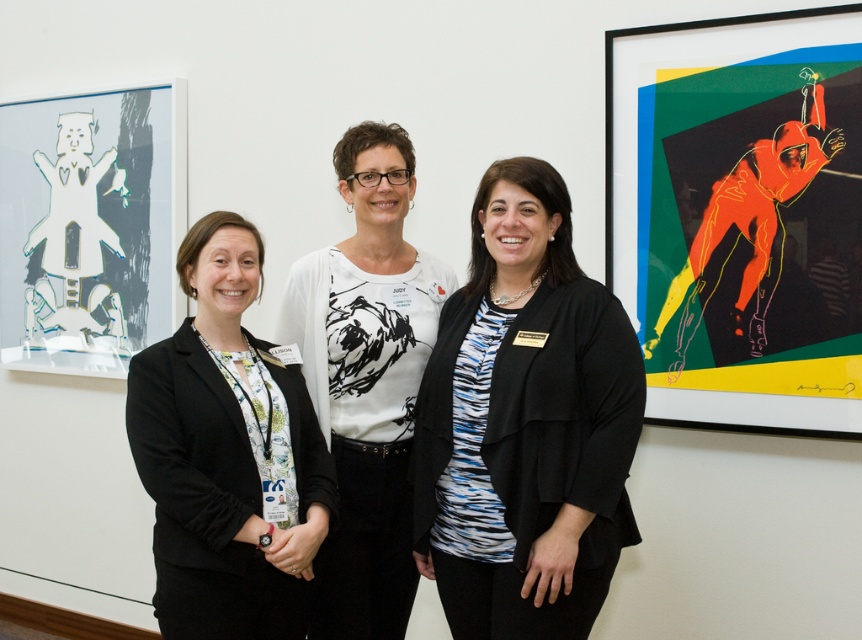
You are a photographer who wants to take a clear photo of the black textured blazer at center without the camera being visible in the frame. Given that the camera and the blazer are 5.75 feet apart, what is the minimum distance you need to move the camera backward to ensure it doesn

The camera and the black textured blazer at center are currently 5.75 feet apart. To avoid the camera appearing in the photo, you need to move it at least 5.75 feet backward so that the distance between them is greater than the camera